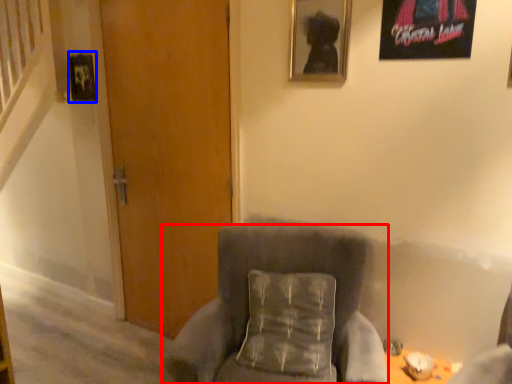
Question: Which object is further to the camera taking this photo, chair (highlighted by a red box) or picture frame (highlighted by a blue box)?

Choices:
 (A) chair
 (B) picture frame

Answer: (B)